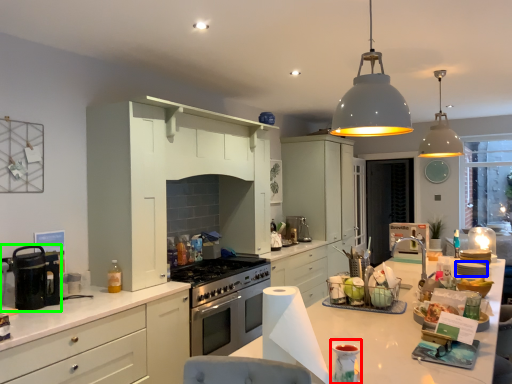
Question: Which is nearer to the appliance (highlighted by a red box)? appliance (highlighted by a blue box) or kitchen appliance (highlighted by a green box).

Choices:
 (A) appliance
 (B) kitchen appliance

Answer: (B)